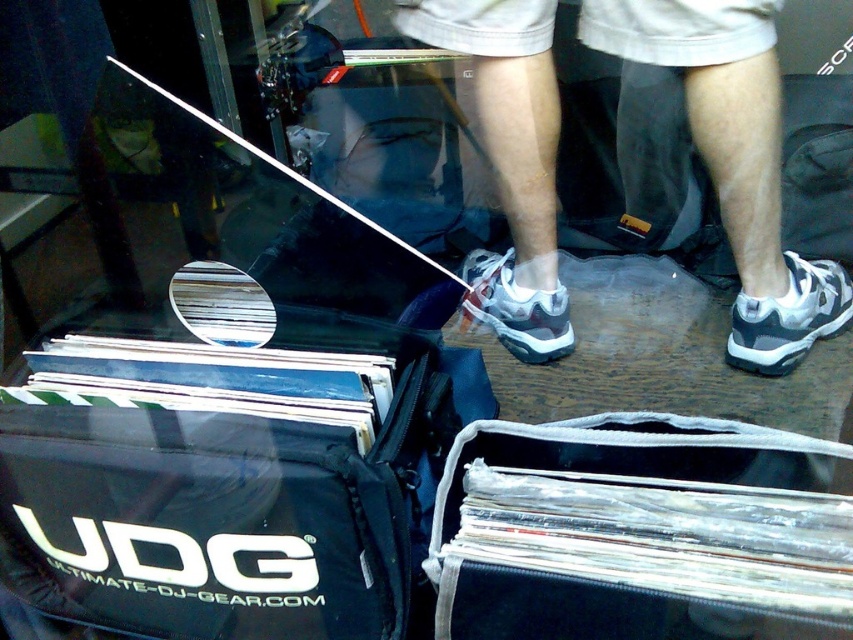
You are standing in a room with a reflective surface. You see a black fabric bag at lower left and a white mesh sneaker at center. Which object is closer to the left side of the room?

The black fabric bag at lower left is closer to the left side of the room because it is positioned to the left of the white mesh sneaker at center.

You are holding a smartphone that is 6.2 inches wide. You want to take a photo of the black fabric bag at lower left from your current position. Can your smartphone fit the entire bag in the frame if the maximum width your camera can capture at this distance is 30 inches?

The black fabric bag at lower left is 33.97 inches away from the viewer. Since the maximum width your camera can capture at this distance is 30 inches, the smartphone cannot fit the entire bag in the frame as the required width exceeds the camera capability.

You are a delivery person who needs to pack the clear plastic vinyl records at lower center and the white mesh sneaker at center into a box. The box has a width of 10 inches. Can both items fit side by side horizontally?

The clear plastic vinyl records at lower center might be wider than white mesh sneaker at center. Since the box is 10 inches wide, if the combined width of both items is less than or equal to 10 inches, they could fit. However, since the vinyl records might be wider, their total width might exceed the box capacity. Without exact measurements, it is uncertain.